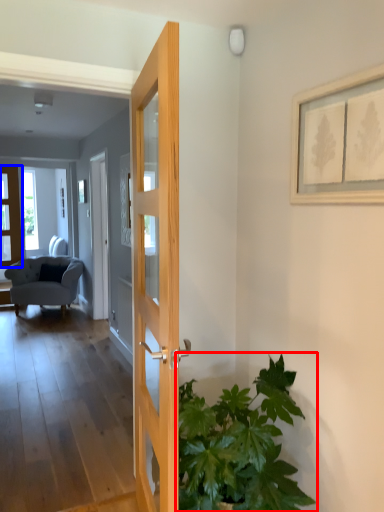
Question: Which object appears closest to the camera in this image, houseplant (highlighted by a red box) or door (highlighted by a blue box)?

Choices:
 (A) houseplant
 (B) door

Answer: (A)